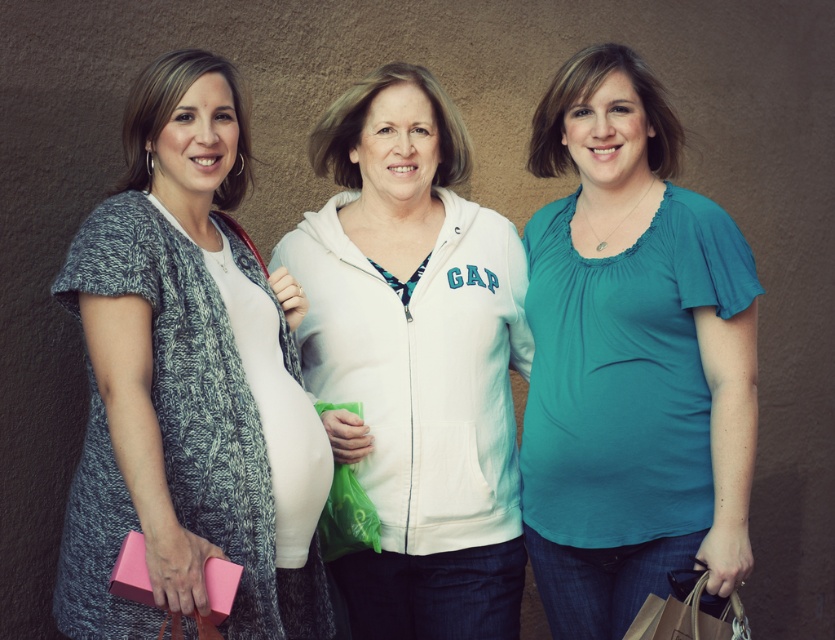
In order to click on teal matte shirt at center in this screenshot , I will do `click(631, 356)`.

Between teal matte shirt at center and white cotton zip-up hoodie at center, which one is positioned higher?

teal matte shirt at center

Image resolution: width=835 pixels, height=640 pixels. I want to click on teal matte shirt at center, so click(x=631, y=356).

Is knitted gray cardigan at left smaller than teal matte shirt at center?

No.

Is knitted gray cardigan at left positioned at the back of teal matte shirt at center?

No, it is in front of teal matte shirt at center.

What do you see at coordinates (188, 380) in the screenshot? I see `knitted gray cardigan at left` at bounding box center [188, 380].

The image size is (835, 640). I want to click on knitted gray cardigan at left, so click(x=188, y=380).

How far apart are teal matte shirt at center and brown paper bag at lower right?

13.85 inches

Does teal matte shirt at center have a lesser width compared to brown paper bag at lower right?

Incorrect, teal matte shirt at center's width is not less than brown paper bag at lower right's.

Which is in front, point (544, 337) or point (661, 628)?

Point (661, 628) is more forward.

This screenshot has height=640, width=835. I want to click on teal matte shirt at center, so click(x=631, y=356).